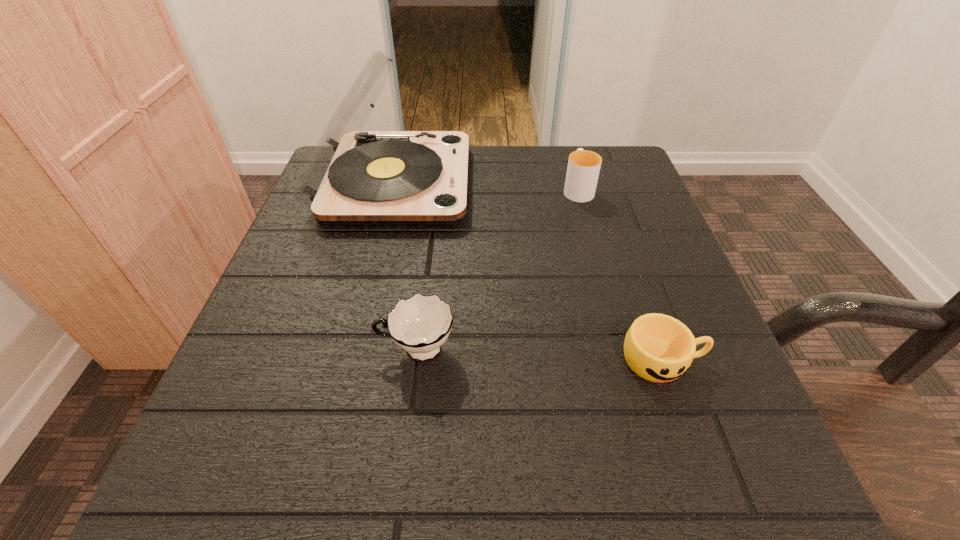
The height and width of the screenshot is (540, 960). I want to click on object that ranks as the third closest to the leftmost cup, so click(583, 169).

Locate which cup is the second closest to the farthest cup. Please provide its 2D coordinates. Your answer should be formatted as a tuple, i.e. [(x, y)], where the tuple contains the x and y coordinates of a point satisfying the conditions above.

[(420, 324)]

Where is `the closest cup to the shortest object`? the closest cup to the shortest object is located at coordinates (420, 324).

Image resolution: width=960 pixels, height=540 pixels. Identify the location of free space that satisfies the following two spatial constraints: 1. with the tonearm facing the front of the record player; 2. with the handle on the side of the farthest cup. (392, 188).

Find the location of a particular element. This screenshot has height=540, width=960. blank area in the image that satisfies the following two spatial constraints: 1. on the side of the leftmost cup with the handle; 2. with the tonearm facing the front of the tallest object is located at coordinates (437, 183).

Find the location of a particular element. The width and height of the screenshot is (960, 540). vacant space that satisfies the following two spatial constraints: 1. with the tonearm facing the front of the tallest object; 2. on the back side of the shortest object is located at coordinates (349, 360).

You are a GUI agent. You are given a task and a screenshot of the screen. Output one action in this format:
    pyautogui.click(x=<x>, y=<y>)
    Task: Click on the free location that satisfies the following two spatial constraints: 1. with the tonearm facing the front of the record player; 2. on the side of the leftmost cup with the handle
    
    Given the screenshot: What is the action you would take?
    pyautogui.click(x=352, y=350)

Find the location of a particular element. The image size is (960, 540). vacant space that satisfies the following two spatial constraints: 1. with the tonearm facing the front of the shortest object; 2. on the right side of the tallest object is located at coordinates (349, 360).

Identify the location of vacant space that satisfies the following two spatial constraints: 1. with the tonearm facing the front of the tallest object; 2. on the side of the leftmost cup with the handle. (352, 350).

This screenshot has width=960, height=540. I want to click on blank space that satisfies the following two spatial constraints: 1. with the handle on the side of the farthest cup; 2. with the tonearm facing the front of the record player, so click(576, 183).